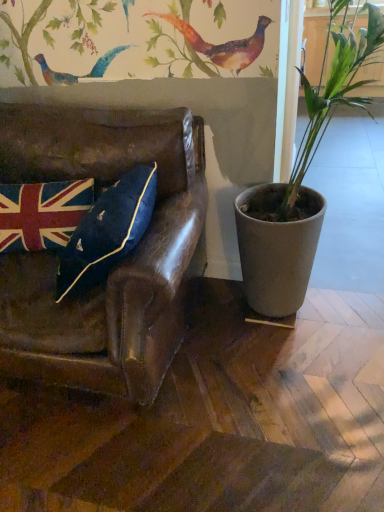
Question: Does matte gray pot at right contain velvet union jack pillow at left?

Choices:
 (A) yes
 (B) no

Answer: (B)

Question: Is the position of matte gray pot at right less distant than that of velvet union jack pillow at left?

Choices:
 (A) yes
 (B) no

Answer: (A)

Question: Considering the relative sizes of matte gray pot at right and velvet union jack pillow at left in the image provided, is matte gray pot at right smaller than velvet union jack pillow at left?

Choices:
 (A) yes
 (B) no

Answer: (B)

Question: Considering the relative positions of matte gray pot at right and velvet union jack pillow at left in the image provided, is matte gray pot at right to the right of velvet union jack pillow at left from the viewer's perspective?

Choices:
 (A) yes
 (B) no

Answer: (A)

Question: Is matte gray pot at right shorter than velvet union jack pillow at left?

Choices:
 (A) no
 (B) yes

Answer: (A)

Question: From the image's perspective, would you say matte gray pot at right is shown under velvet union jack pillow at left?

Choices:
 (A) yes
 (B) no

Answer: (B)

Question: Could you tell me if velvet union jack pillow at left is facing matte gray pot at right?

Choices:
 (A) yes
 (B) no

Answer: (B)

Question: Is velvet union jack pillow at left not near matte gray pot at right?

Choices:
 (A) yes
 (B) no

Answer: (B)

Question: From the image's perspective, is velvet union jack pillow at left on top of matte gray pot at right?

Choices:
 (A) no
 (B) yes

Answer: (A)

Question: Can you confirm if velvet union jack pillow at left is taller than matte gray pot at right?

Choices:
 (A) no
 (B) yes

Answer: (A)

Question: Can you confirm if velvet union jack pillow at left is positioned to the right of matte gray pot at right?

Choices:
 (A) no
 (B) yes

Answer: (A)

Question: Is velvet union jack pillow at left turned away from matte gray pot at right?

Choices:
 (A) no
 (B) yes

Answer: (A)

Question: Is velvet union jack pillow at left completely or partially inside leather couch at left?

Choices:
 (A) no
 (B) yes

Answer: (B)